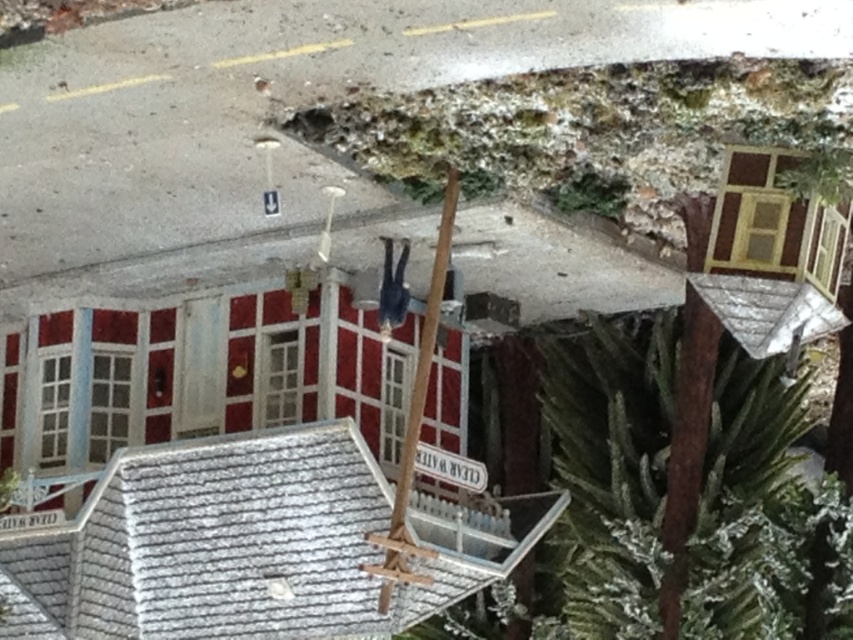
You are a photographer standing at the base of the green mossy tree trunk at upper center. You want to take a photo of the building with the red facade and white trim in the background. Considering your current position, will the building be in focus if you set your camera to focus at 4 meters?

The green mossy tree trunk at upper center is 4.24 meters away from the camera. Since the focus is set at 4 meters, the building behind it would be slightly out of focus because the distance is beyond the focused range.

In the scene shown: You are a bird looking for a higher perch. Which of the two trees, the green mossy tree trunk at upper center or the green textured pine tree at center right, should you choose?

The green textured pine tree at center right is taller than the green mossy tree trunk at upper center, so you should choose the green textured pine tree at center right for a higher perch.

You are a tiny gardener in the diorama who wants to plant a new sapling. Which of the two trees, the green mossy tree trunk at upper center or the green textured pine tree at center right, has more space around it for planting?

The green textured pine tree at center right has more space around it for planting since the green mossy tree trunk at upper center occupies less space.